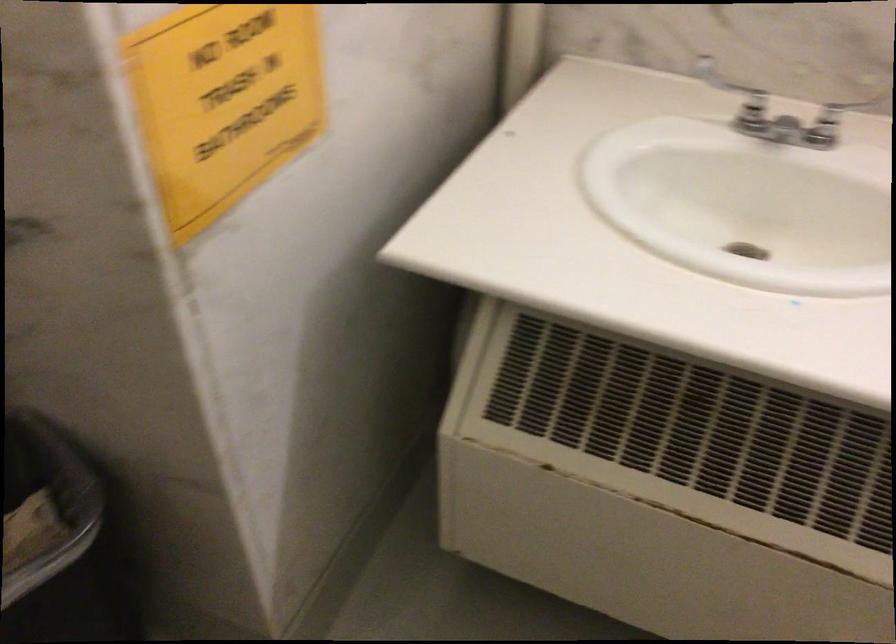
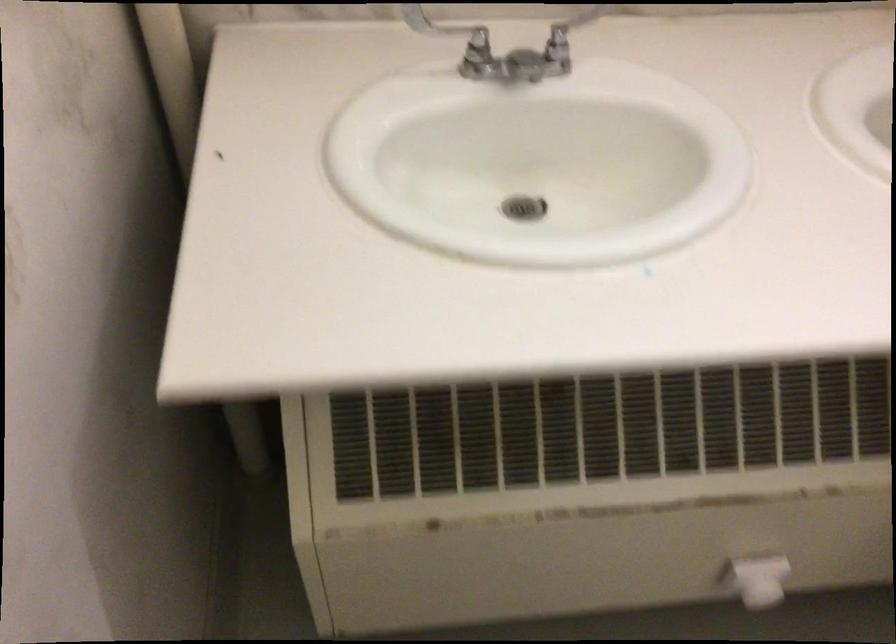
Question: Based on the continuous images, in which direction is the camera rotating? Reply with the corresponding letter.

Choices:
 (A) Left
 (B) Right
 (C) Up
 (D) Down

Answer: (B)